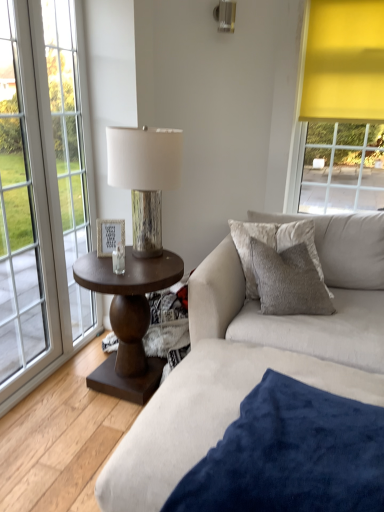
You are a GUI agent. You are given a task and a screenshot of the screen. Output one action in this format:
    pyautogui.click(x=<x>, y=<y>)
    Task: Click on the vacant space in front of white wood picture frame at center
    
    Given the screenshot: What is the action you would take?
    pyautogui.click(x=104, y=265)